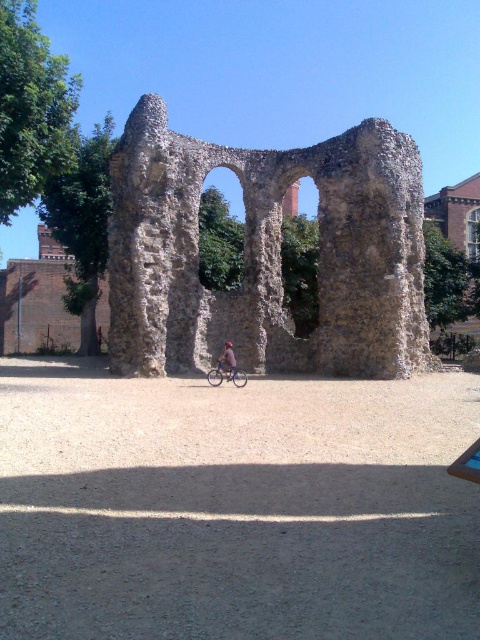
Does shiny metallic bicycle at center have a lesser width compared to blue fabric bicycle at center?

Incorrect, shiny metallic bicycle at center's width is not less than blue fabric bicycle at center's.

Who is positioned more to the left, shiny metallic bicycle at center or blue fabric bicycle at center?

shiny metallic bicycle at center

Measure the distance between point (208, 371) and camera.

A distance of 65.34 meters exists between point (208, 371) and camera.

This screenshot has height=640, width=480. In order to click on shiny metallic bicycle at center in this screenshot , I will do `click(227, 374)`.

Is stone arches at center bigger than shiny metallic bicycle at center?

Yes, stone arches at center is bigger than shiny metallic bicycle at center.

Between point (118, 333) and point (242, 380), which one is positioned in front?

Point (242, 380) is more forward.

Locate an element on the screen. stone arches at center is located at coordinates (266, 253).

Who is more forward, (122, 252) or (228, 348)?

Point (228, 348)

Does stone arches at center lie in front of blue fabric bicycle at center?

No.

Is point (335, 208) less distant than point (232, 355)?

No, (335, 208) is further to viewer.

What are the coordinates of `stone arches at center` in the screenshot? It's located at (266, 253).